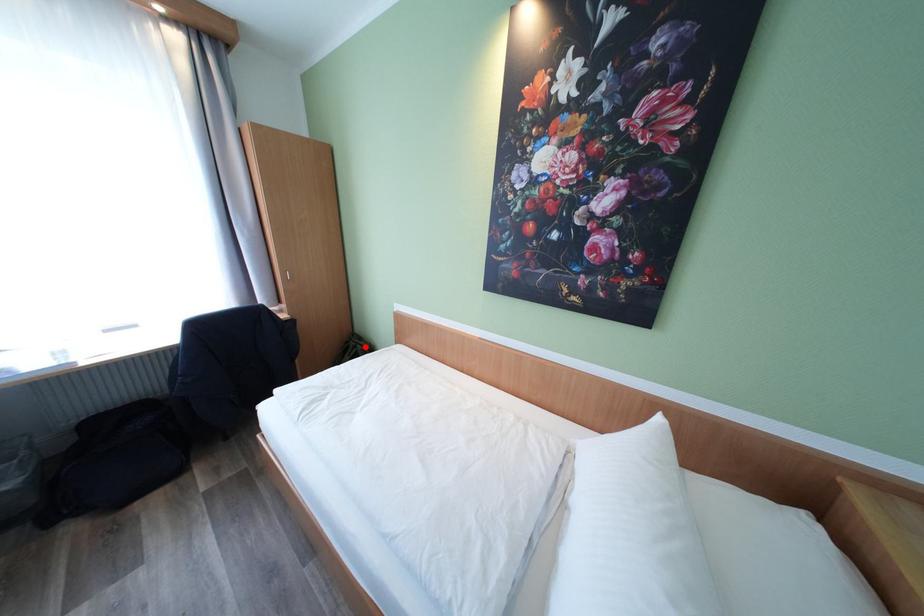
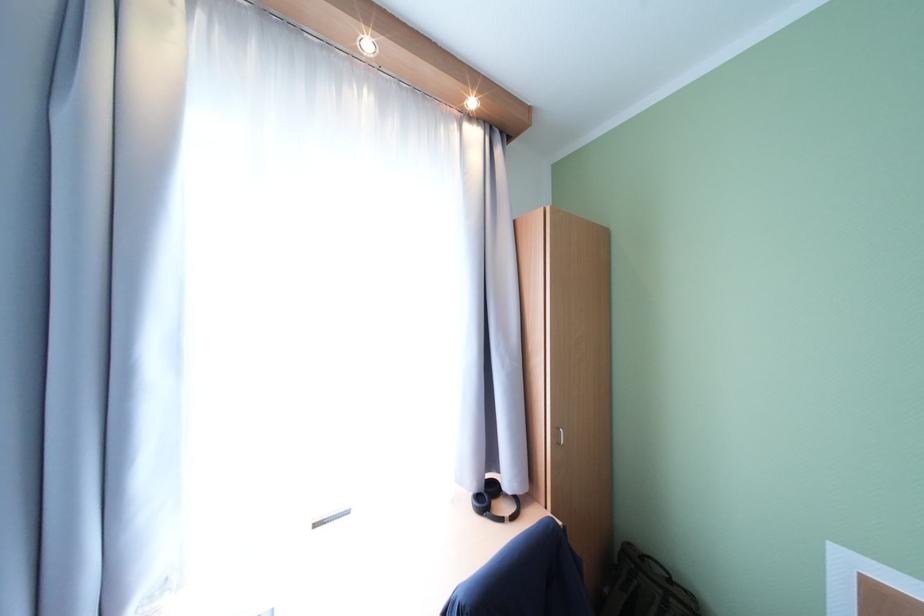
Locate, in the second image, the point that corresponds to the highlighted location in the first image.

(679, 602)